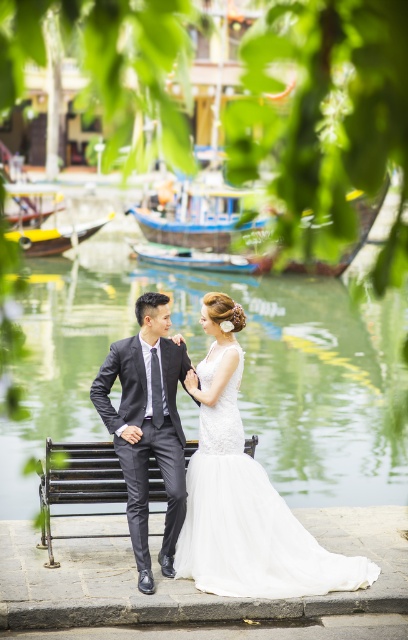
Looking at this image, you are a photographer trying to capture the couple in their wedding attire. You notice the white lace dress at center and the black metal bench at center. Based on their positions, which object is closer to the camera?

The white lace dress at center is located above the black metal bench at center, which means it is closer to the camera.

You are a photographer planning to take a photo of the couple seated on the dark wooden bench. You want to ensure the clear water at bench center and the wooden boat at lower left are both visible in the frame. Based on their heights, which object should be placed closer to the camera to maintain both in focus?

The clear water at bench center has a greater height compared to the wooden boat at lower left. To maintain both in focus, the wooden boat at lower left should be placed closer to the camera since it is shorter, allowing the taller clear water at bench center to still be within the depth of field.